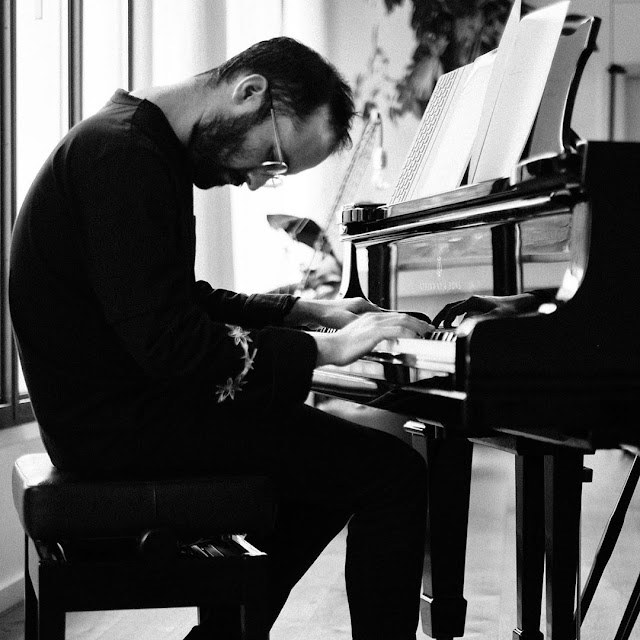
Find the location of `piano`. piano is located at coordinates (468, 240).